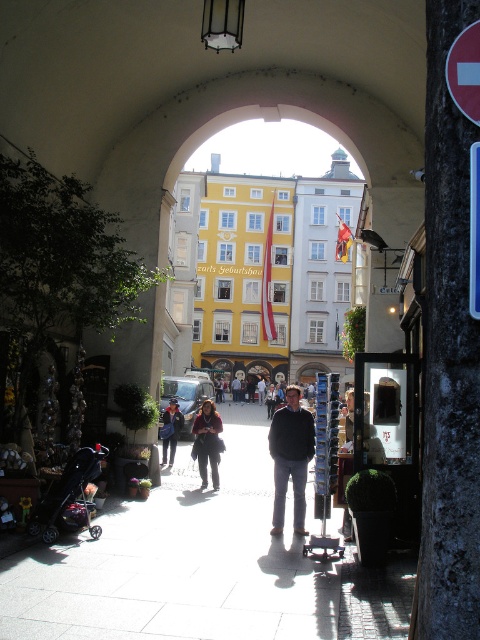
Can you confirm if dark gray sweater at center is positioned to the left of dark brown leather jacket at center?

In fact, dark gray sweater at center is to the right of dark brown leather jacket at center.

Does dark gray sweater at center have a greater width compared to dark brown leather jacket at center?

Yes.

Who is more forward, (x=277, y=416) or (x=196, y=432)?

Point (x=277, y=416) is more forward.

The width and height of the screenshot is (480, 640). Identify the location of dark gray sweater at center. (290, 458).

Is dark gray sweater at center shorter than denim jacket at center?

Incorrect, dark gray sweater at center's height does not fall short of denim jacket at center's.

What do you see at coordinates (290, 458) in the screenshot?
I see `dark gray sweater at center` at bounding box center [290, 458].

Image resolution: width=480 pixels, height=640 pixels. What are the coordinates of `dark gray sweater at center` in the screenshot? It's located at (290, 458).

Measure the distance between dark brown leather jacket at center and denim jacket at center.

7.30 meters

Is dark brown leather jacket at center behind denim jacket at center?

No, it is in front of denim jacket at center.

Is point (216, 481) less distant than point (168, 442)?

Yes, point (216, 481) is closer to viewer.

The width and height of the screenshot is (480, 640). What are the coordinates of `dark brown leather jacket at center` in the screenshot? It's located at (207, 442).